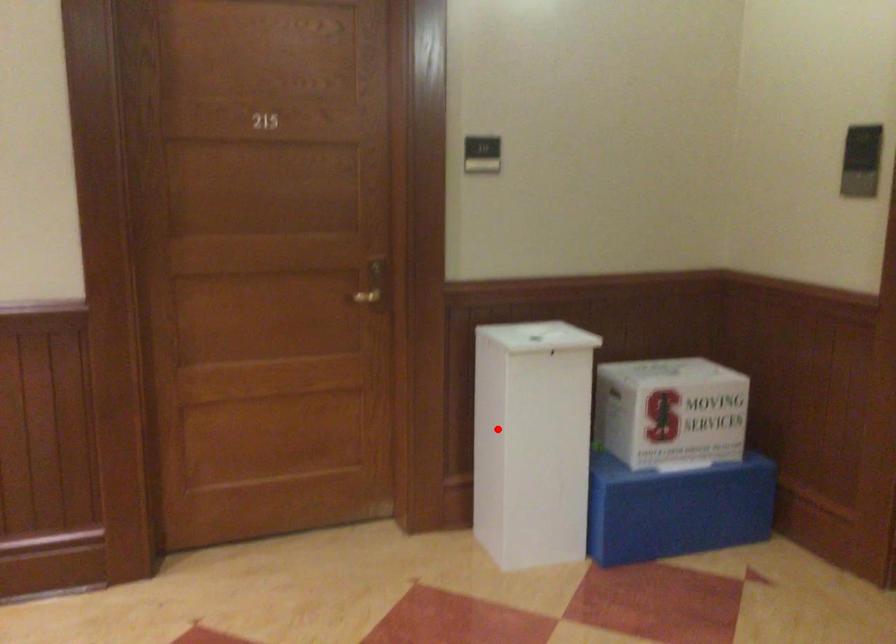
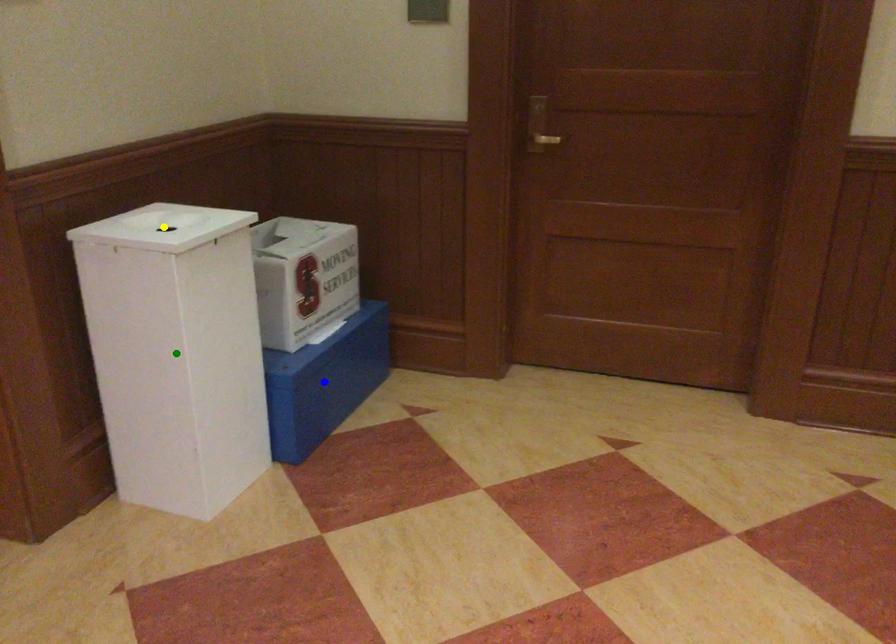
Question: I am providing you with two images of the same scene from different viewpoints. A red point is marked on the first image. You are given multiple points on the second image. Which point in image 2 represents the same 3d spot as the red point in image 1?

Choices:
 (A) green point
 (B) yellow point
 (C) blue point

Answer: (A)